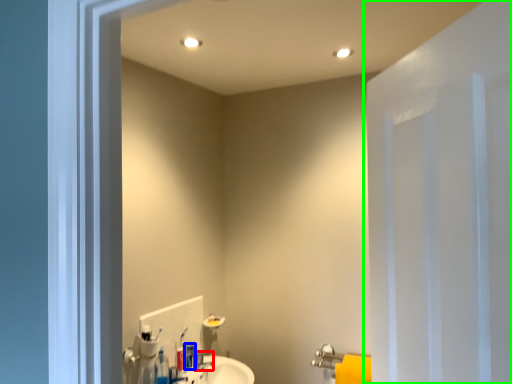
Question: Which object is positioned farthest from plumbing fixture (highlighted by a red box)? Select from toiletry (highlighted by a blue box) and door (highlighted by a green box).

Choices:
 (A) toiletry
 (B) door

Answer: (B)